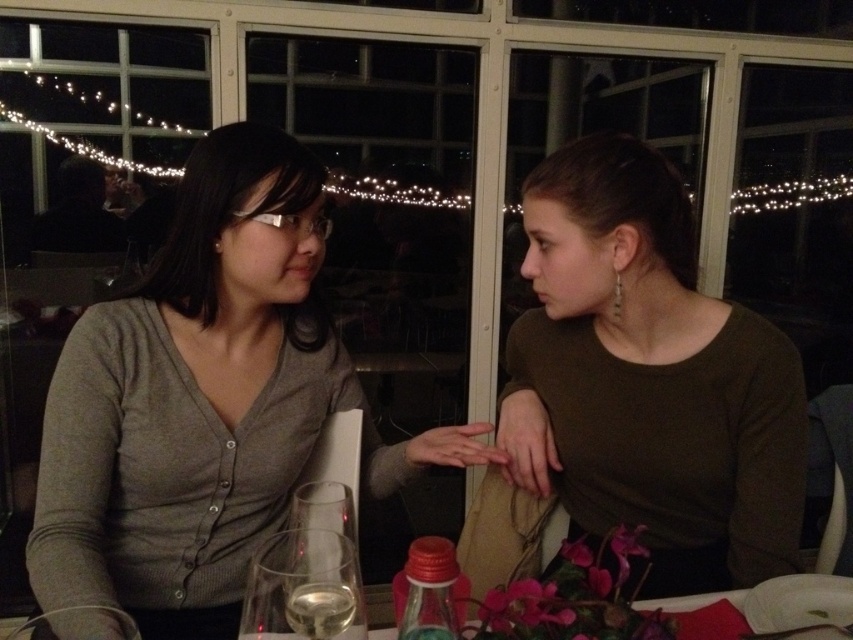
Is matte brown shirt at center smaller than clear glass wine glass at lower left?

No.

Does point (640, 444) come farther from viewer compared to point (305, 563)?

Yes, point (640, 444) is behind point (305, 563).

At what (x,y) coordinates should I click in order to perform the action: click on matte brown shirt at center. Please return your answer as a coordinate pair (x, y). Looking at the image, I should click on (648, 378).

This screenshot has height=640, width=853. What do you see at coordinates (204, 401) in the screenshot?
I see `matte gray cardigan at left` at bounding box center [204, 401].

Between matte gray cardigan at left and matte brown shirt at center, which one has less height?

matte brown shirt at center is shorter.

Is point (94, 483) closer to viewer compared to point (607, 477)?

Yes, point (94, 483) is closer to viewer.

The height and width of the screenshot is (640, 853). Identify the location of matte gray cardigan at left. (204, 401).

Is matte gray cardigan at left smaller than clear glass wine glass at lower left?

Actually, matte gray cardigan at left might be larger than clear glass wine glass at lower left.

Between matte gray cardigan at left and clear glass wine glass at lower left, which one has more height?

matte gray cardigan at left

Describe the element at coordinates (204, 401) in the screenshot. The height and width of the screenshot is (640, 853). I see `matte gray cardigan at left` at that location.

Locate an element on the screen. Image resolution: width=853 pixels, height=640 pixels. matte gray cardigan at left is located at coordinates (204, 401).